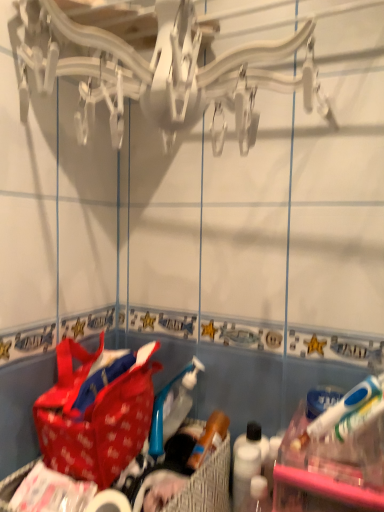
Question: Looking at their shapes, would you say red fabric picnic basket at lower center is wider or thinner than white matte toilet paper at lower center?

Choices:
 (A) wide
 (B) thin

Answer: (A)

Question: Based on their positions, is red fabric picnic basket at lower center located to the left or right of white matte toilet paper at lower center?

Choices:
 (A) left
 (B) right

Answer: (A)

Question: Which is farther from the red fabric handbag at lower left?

Choices:
 (A) red fabric picnic basket at lower center
 (B) white matte toilet paper at lower center

Answer: (A)

Question: Estimate the real-world distances between objects in this image. Which object is closer to the red fabric picnic basket at lower center?

Choices:
 (A) white matte toilet paper at lower center
 (B) red fabric handbag at lower left

Answer: (A)